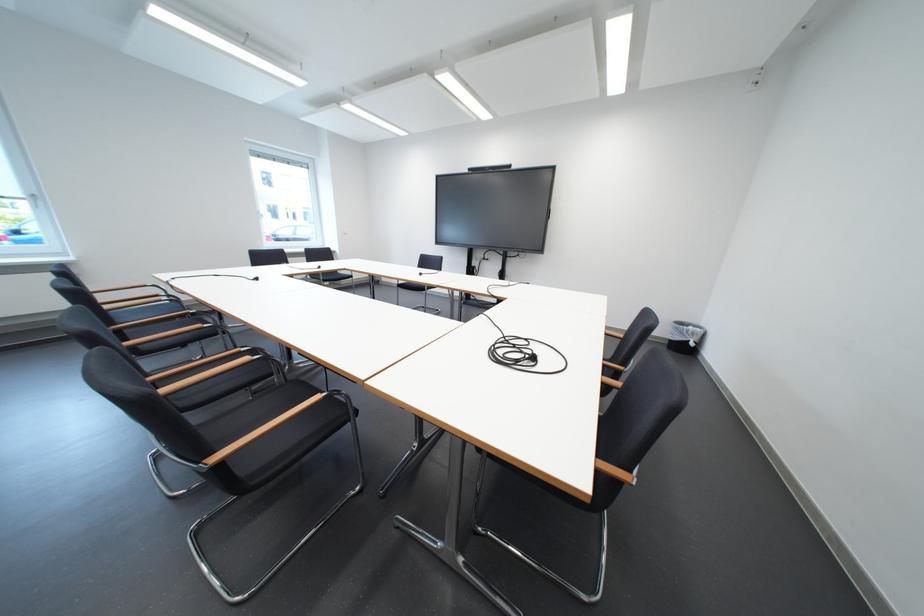
The location [523,354] corresponds to which object?

It refers to a coiled black cable.